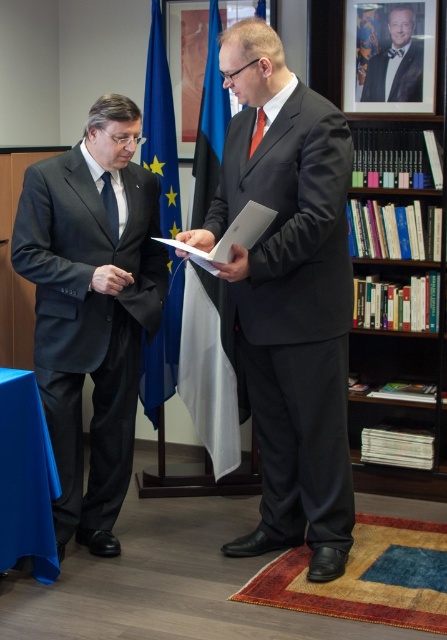
Can you confirm if matte black suit at center is positioned to the left of orange silk tie at center?

Incorrect, matte black suit at center is not on the left side of orange silk tie at center.

Between matte black suit at center and orange silk tie at center, which one has less height?

orange silk tie at center

Does point (330, 474) come farther from viewer compared to point (260, 113)?

That is True.

The width and height of the screenshot is (447, 640). I want to click on matte black suit at center, so click(x=290, y=296).

Who is positioned more to the right, blue fabric flag at center or black satin bow tie at upper center?

From the viewer's perspective, black satin bow tie at upper center appears more on the right side.

Does blue fabric flag at center appear on the left side of black satin bow tie at upper center?

Correct, you'll find blue fabric flag at center to the left of black satin bow tie at upper center.

Image resolution: width=447 pixels, height=640 pixels. I want to click on blue fabric flag at center, so click(x=210, y=369).

What are the coordinates of `blue fabric flag at center` in the screenshot? It's located at (210, 369).

Who is more forward, (x=228, y=381) or (x=108, y=188)?

Point (x=108, y=188) is more forward.

What do you see at coordinates (210, 369) in the screenshot?
I see `blue fabric flag at center` at bounding box center [210, 369].

Identify the location of blue fabric flag at center. This screenshot has width=447, height=640. (210, 369).